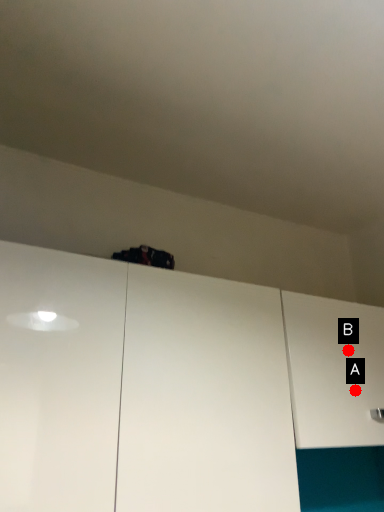
Question: Two points are circled on the image, labeled by A and B beside each circle. Which point is closer to the camera?

Choices:
 (A) A is closer
 (B) B is closer

Answer: (A)